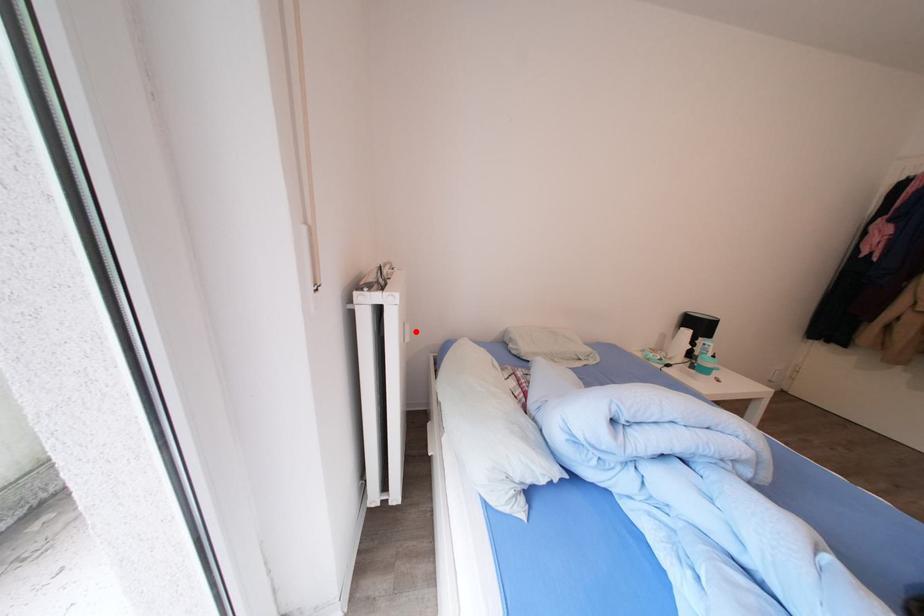
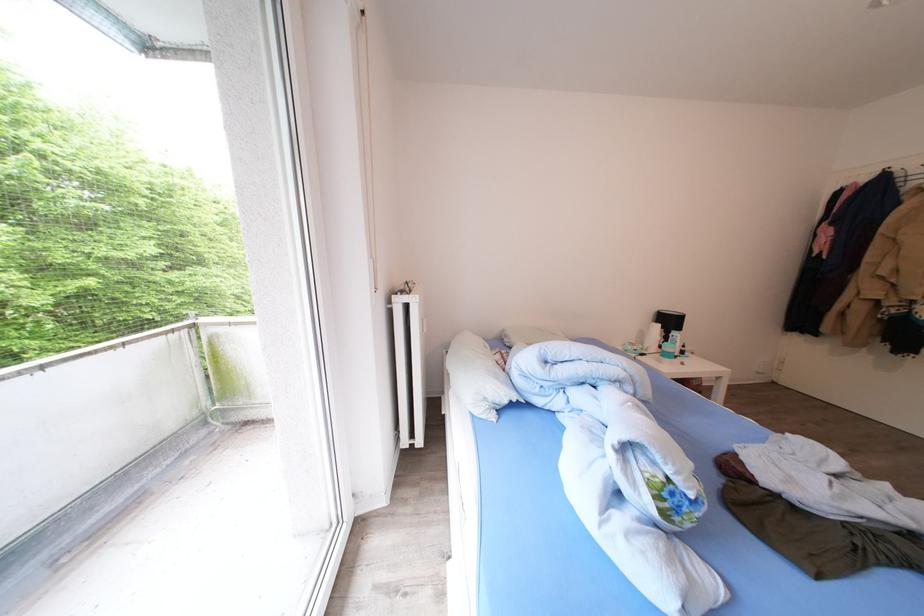
The point at the highlighted location is marked in the first image. Where is the corresponding point in the second image?

(433, 326)